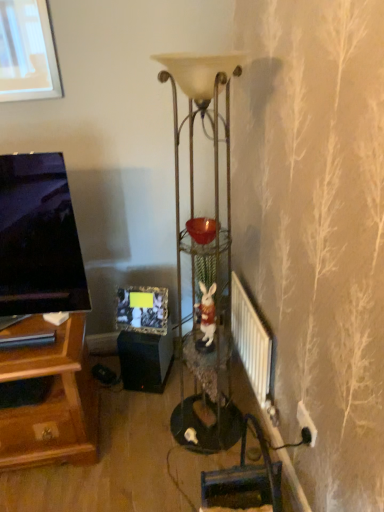
The width and height of the screenshot is (384, 512). I want to click on vacant space to the left of black matte speaker at lower center, so click(109, 379).